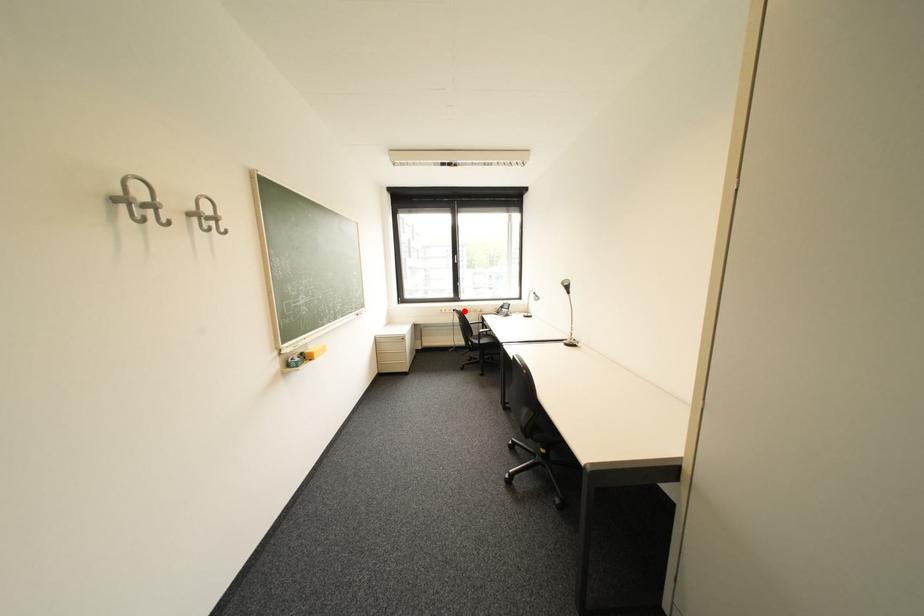
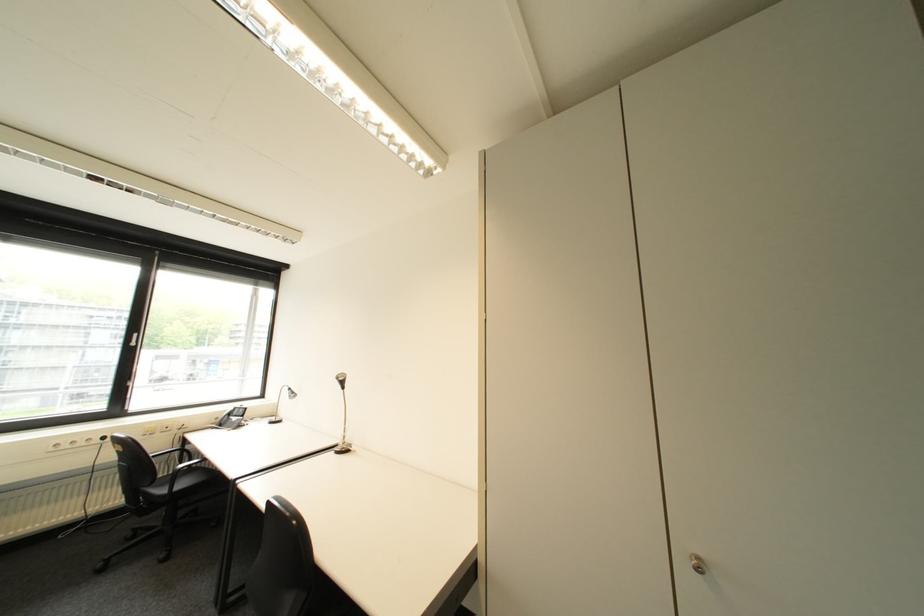
Question: A red point is marked in image1. In image2, is the corresponding 3D point closer to the camera or farther? Reply with the corresponding letter.

Choices:
 (A) The corresponding 3D point is closer.
 (B) The corresponding 3D point is farther.

Answer: (A)